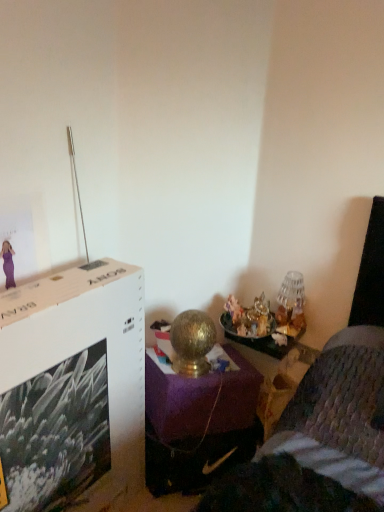
Question: Looking at their shapes, would you say white cardboard file cabinet at upper left is wider or thinner than gold metallic table lamp at right?

Choices:
 (A) thin
 (B) wide

Answer: (B)

Question: Considering their positions, is white cardboard file cabinet at upper left located in front of or behind gold metallic table lamp at right?

Choices:
 (A) front
 (B) behind

Answer: (A)

Question: Which is farther from the gold metallic table at center?

Choices:
 (A) white cardboard file cabinet at upper left
 (B) gold metallic table lamp at right

Answer: (A)

Question: Based on their relative distances, which object is farther from the gold metallic table at center?

Choices:
 (A) gold metallic table lamp at right
 (B) white cardboard file cabinet at upper left

Answer: (B)